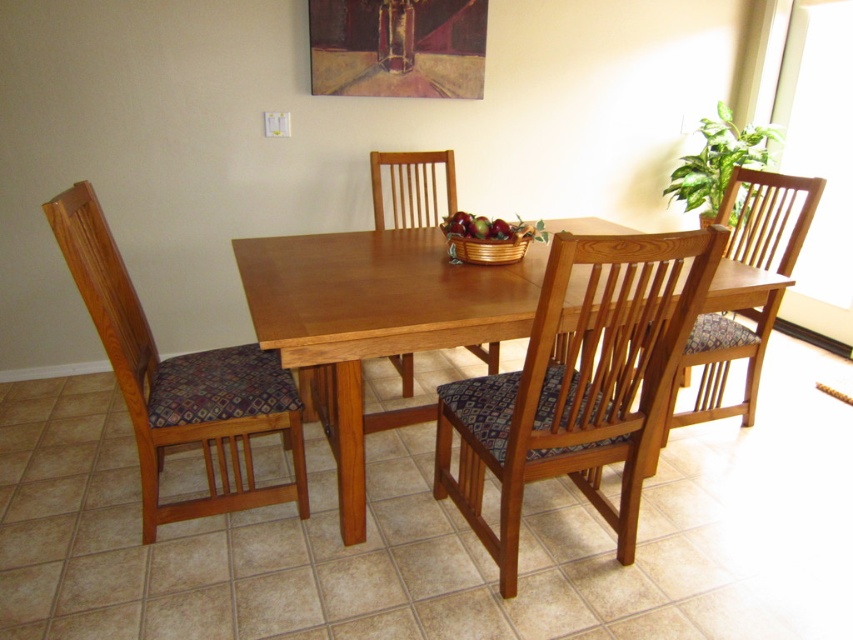
You are standing at the entrance of the dining area and want to walk towards the two points marked in the image. Which point would you reach first, point (x=618, y=292) or point (x=741, y=403)?

Point (x=618, y=292) is in front of point (x=741, y=403), so you would reach point (x=618, y=292) first.

You are a guest at a dinner party and need to choose a seat. You prefer a taller chair. Which chair should you choose between the wooden chair with patterned cushion at center and the wooden chair with patterned cushion at right?

The wooden chair with patterned cushion at right is taller than the wooden chair with patterned cushion at center, so you should choose the wooden chair with patterned cushion at right.

You are a delivery person holding a large box that is 1.5 meters wide. You need to place it in the dining area shown. Is there enough space between the wooden chair with patterned cushion at center and the camera to fit the box?

The distance between the wooden chair with patterned cushion at center and the camera is 1.41 meters, which is slightly less than the box width of 1.5 meters. Therefore, the box cannot fit in that space.